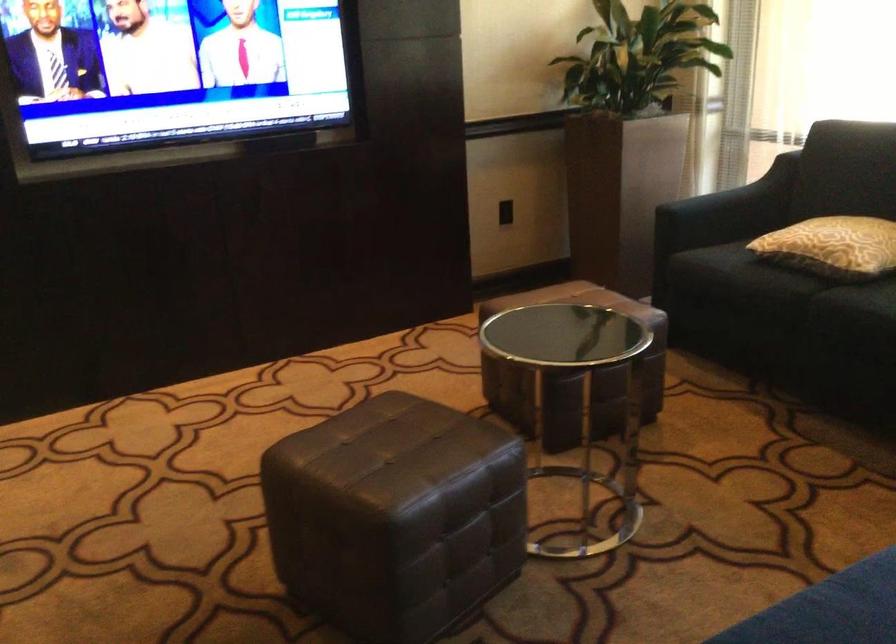
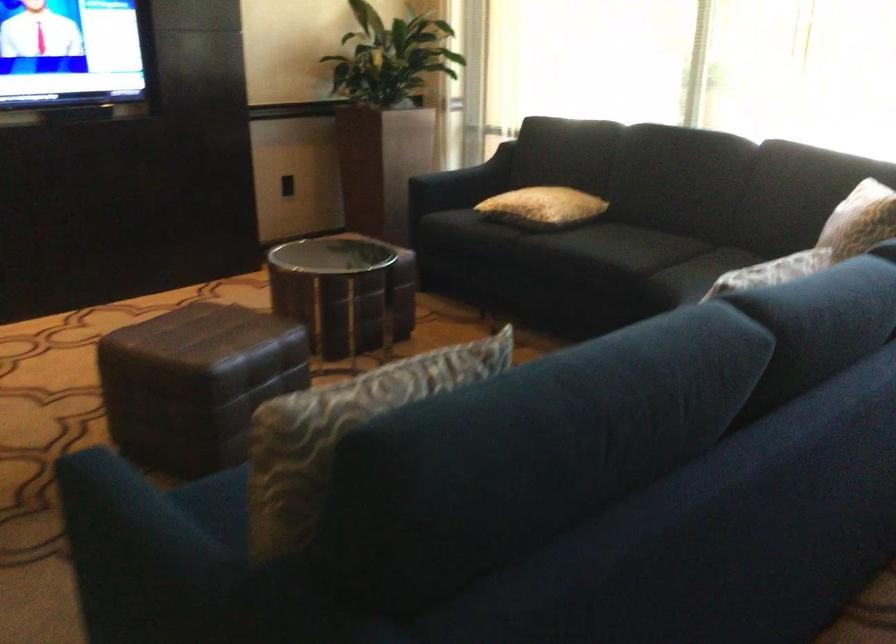
Question: The camera is either moving clockwise (left) or counter-clockwise (right) around the object. The first image is from the beginning of the video and the second image is from the end. Is the camera moving left or right when shooting the video?

Choices:
 (A) Left
 (B) Right

Answer: (A)